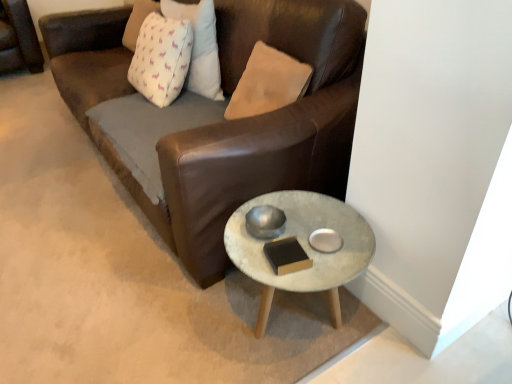
Question: Looking at their shapes, would you say white fabric pillow at upper left is wider or thinner than marble-coated coffee table at lower right?

Choices:
 (A) wide
 (B) thin

Answer: (B)

Question: Is white fabric pillow at upper left bigger or smaller than marble-coated coffee table at lower right?

Choices:
 (A) big
 (B) small

Answer: (B)

Question: Is white fabric pillow at upper left inside or outside of marble-coated coffee table at lower right?

Choices:
 (A) outside
 (B) inside

Answer: (A)

Question: Looking at the image, does marble-coated coffee table at lower right seem bigger or smaller compared to white fabric pillow at upper left?

Choices:
 (A) small
 (B) big

Answer: (B)

Question: Does point [x=336, y=215] appear closer or farther from the camera than point [x=194, y=72]?

Choices:
 (A) closer
 (B) farther

Answer: (A)

Question: From a real-world perspective, is marble-coated coffee table at lower right positioned above or below white fabric pillow at upper left?

Choices:
 (A) above
 (B) below

Answer: (B)

Question: Looking at their shapes, would you say marble-coated coffee table at lower right is wider or thinner than white fabric pillow at upper left?

Choices:
 (A) wide
 (B) thin

Answer: (A)